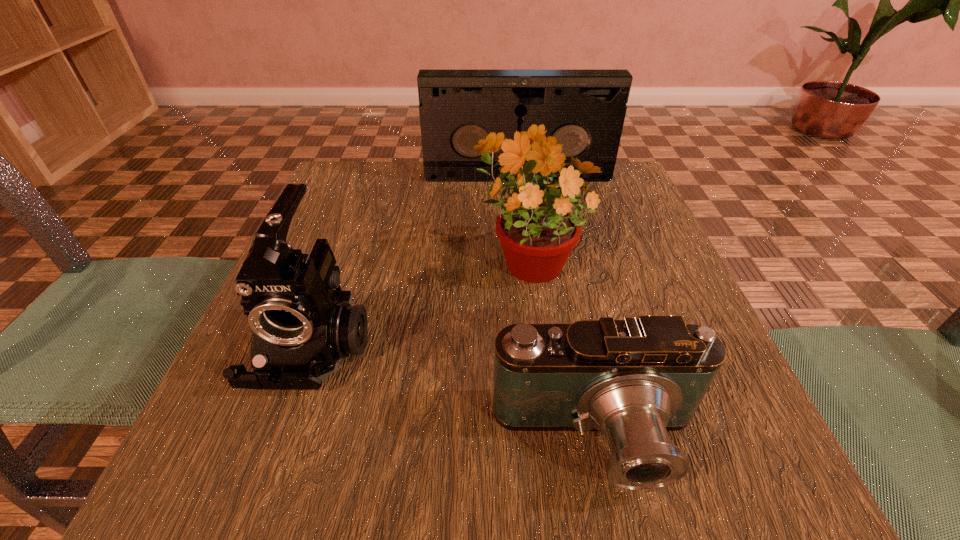
The height and width of the screenshot is (540, 960). I want to click on the third nearest object, so click(x=537, y=227).

Where is `the farthest object`? Image resolution: width=960 pixels, height=540 pixels. the farthest object is located at coordinates (588, 107).

Find the location of `the leftmost object`. the leftmost object is located at coordinates coord(302,329).

Identify the location of the left camcorder. (302, 329).

This screenshot has height=540, width=960. Identify the location of the shorter camcorder. (635, 379).

Identify the location of the shortest object. (635, 379).

Find the location of a particular element. The width and height of the screenshot is (960, 540). free space located on the left of the second farthest object is located at coordinates (316, 258).

At what (x,y) coordinates should I click in order to perform the action: click on free space located 0.130m on the front side of the videotape. Please return your answer as a coordinate pair (x, y). This screenshot has width=960, height=540. Looking at the image, I should click on (522, 212).

The image size is (960, 540). Find the location of `vacant region located on the lens mount of the taller camcorder`. vacant region located on the lens mount of the taller camcorder is located at coordinates (263, 484).

Find the location of a particular element. The width and height of the screenshot is (960, 540). object that is at the far edge is located at coordinates (588, 107).